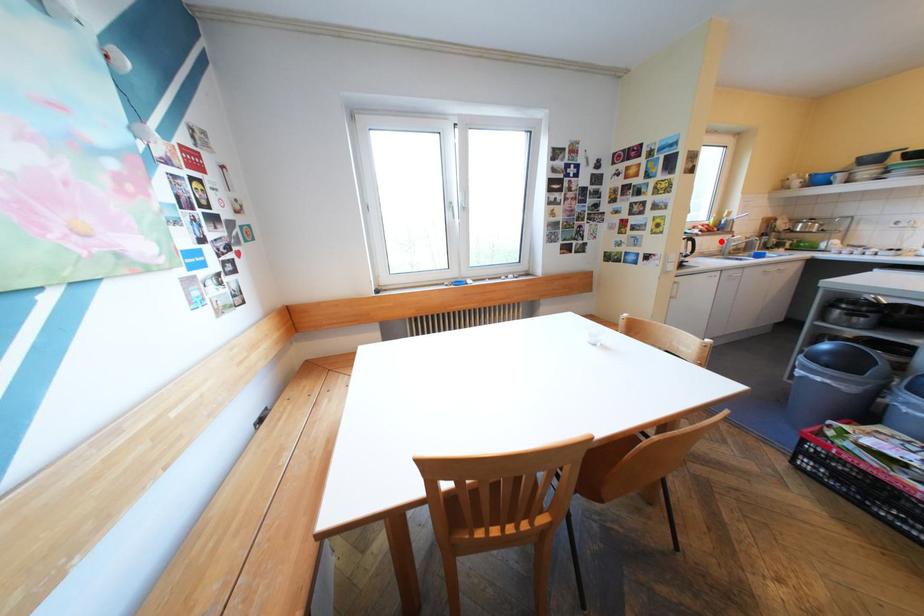
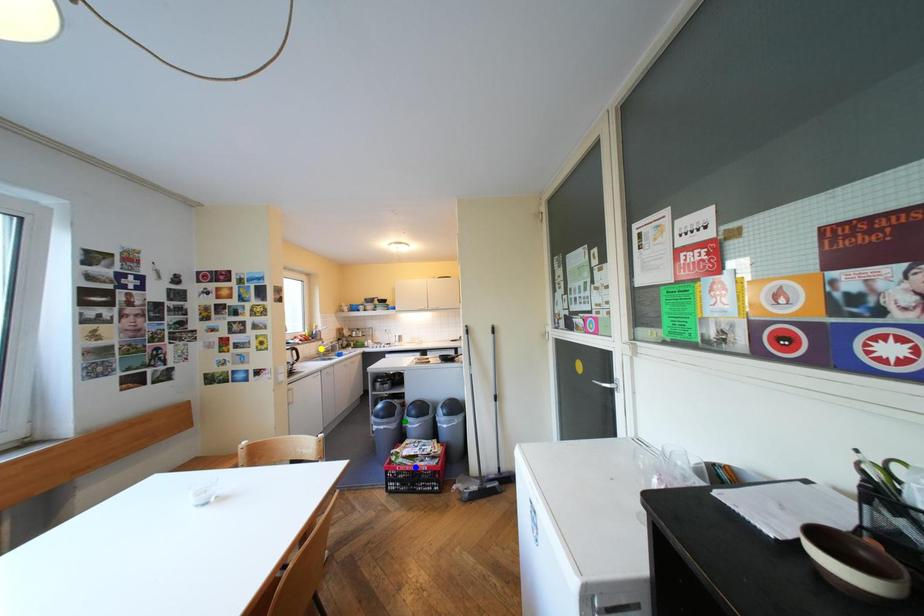
Question: I am providing you with two images of the same scene from different viewpoints. A red point is marked on the first image. You are given multiple points on the second image. Which point in image 2 is actually the same real-world point as the red point in image 1?

Choices:
 (A) blue point
 (B) yellow point
 (C) green point

Answer: (B)